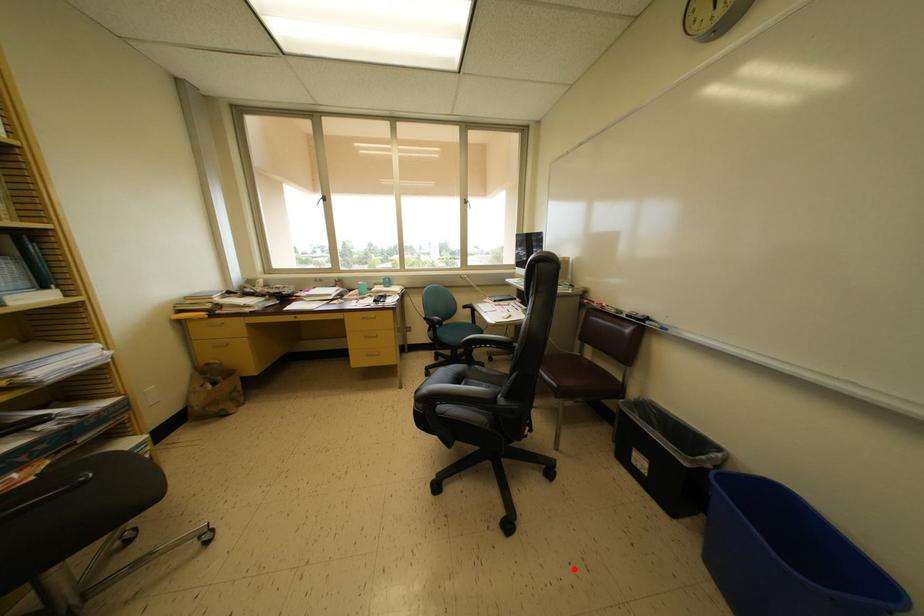
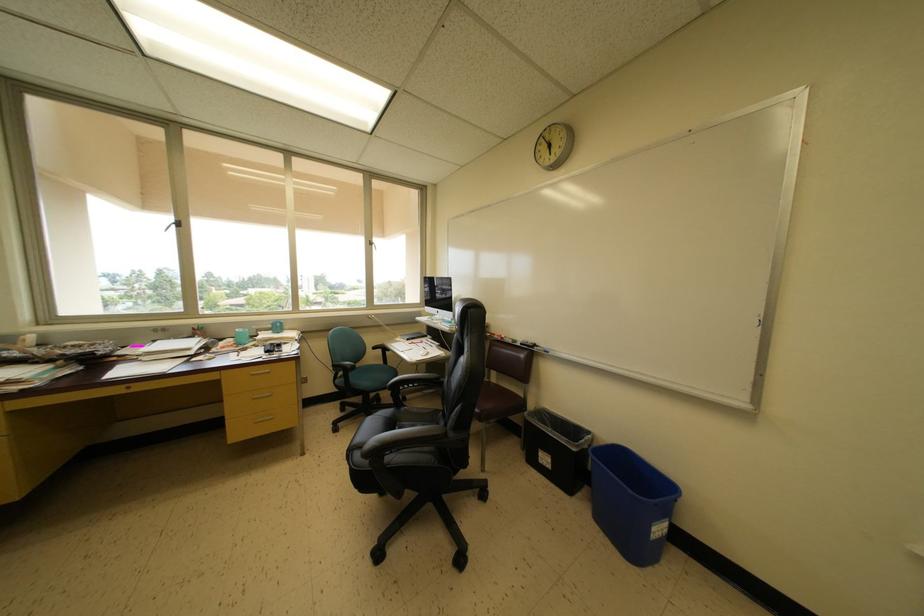
Locate, in the second image, the point that corresponds to the highlighted location in the first image.

(520, 573)